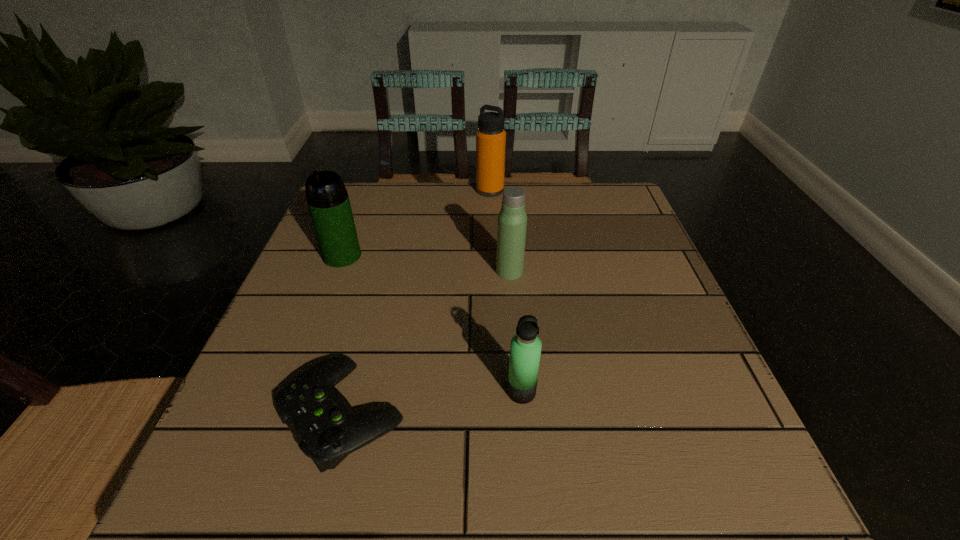
Where is `thermos bottle located in the left edge section of the desktop`? The width and height of the screenshot is (960, 540). thermos bottle located in the left edge section of the desktop is located at coordinates (327, 198).

Identify the location of control located in the left edge section of the desktop. This screenshot has height=540, width=960. (321, 419).

This screenshot has height=540, width=960. What are the coordinates of `object that is at the near left corner` in the screenshot? It's located at (321, 419).

Where is `blank area at the far edge`? The height and width of the screenshot is (540, 960). blank area at the far edge is located at coordinates (494, 201).

The image size is (960, 540). In the image, there is a desktop. What are the coordinates of `free space at the near edge` in the screenshot? It's located at (393, 474).

Find the location of a particular element. vacant space at the left edge of the desktop is located at coordinates (347, 268).

You are a GUI agent. You are given a task and a screenshot of the screen. Output one action in this format:
    pyautogui.click(x=<x>, y=<y>)
    Task: Click on the vacant area at the right edge
    
    Given the screenshot: What is the action you would take?
    pyautogui.click(x=588, y=241)

Image resolution: width=960 pixels, height=540 pixels. I want to click on free space at the far left corner of the desktop, so click(x=386, y=183).

The height and width of the screenshot is (540, 960). I want to click on free space at the far right corner of the desktop, so click(x=590, y=185).

I want to click on free spot between the control and the farthest thermos bottle, so click(x=417, y=302).